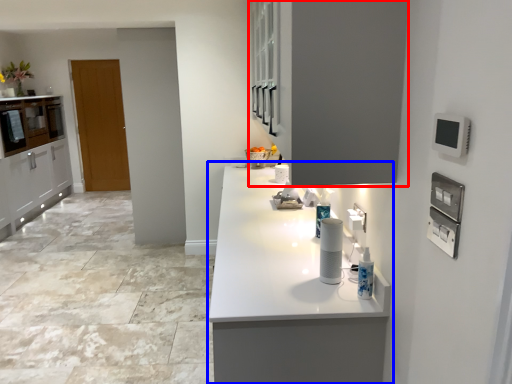
Question: Which point is closer to the camera, cabinetry (highlighted by a red box) or countertop (highlighted by a blue box)?

Choices:
 (A) cabinetry
 (B) countertop

Answer: (A)